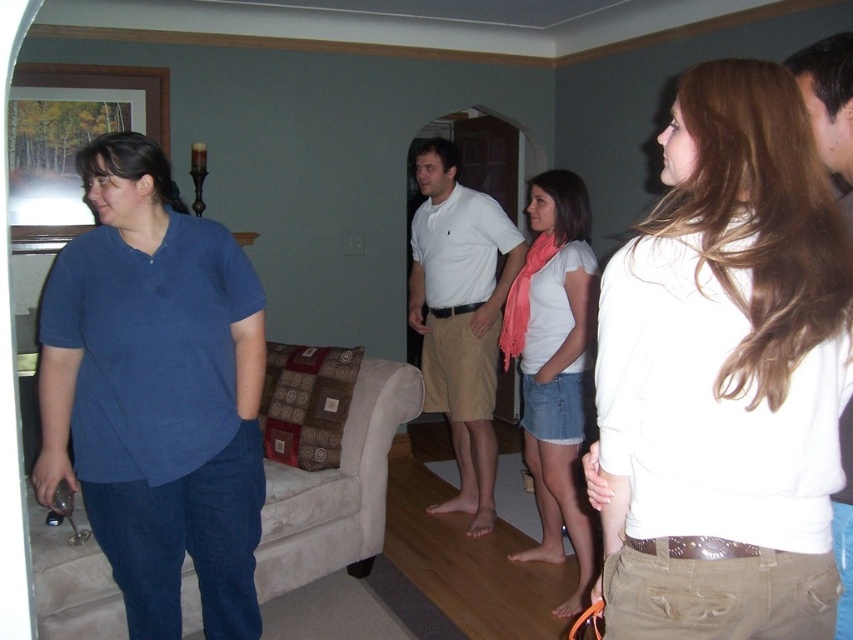
You are organizing a photo shoot and need to place two models wearing the white matte shirt at upper right and the matte blue shirt at left in a row. Which model should stand on the left side to make the row look balanced?

The white matte shirt at upper right is thinner than the matte blue shirt at left, so placing the thinner white matte shirt at upper right on the left side and the thicker matte blue shirt at left on the right side would create a balanced appearance.

What are the coordinates of the white matte shirt at upper right in the image?

The white matte shirt at upper right is located at coordinates (726, 374).